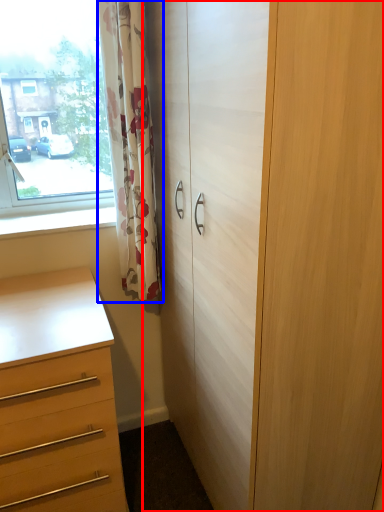
Question: Which object is further to the camera taking this photo, cupboard (highlighted by a red box) or curtain (highlighted by a blue box)?

Choices:
 (A) cupboard
 (B) curtain

Answer: (B)